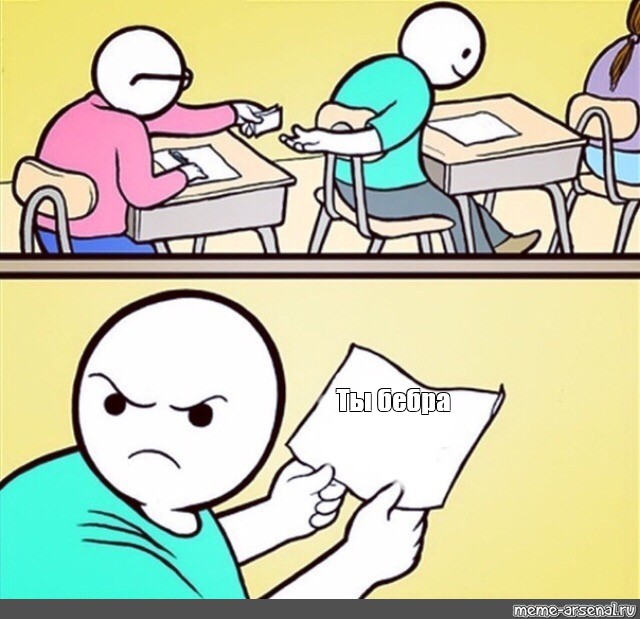
Locate an element on the screen. side of desk on the top left is located at coordinates (205, 210).